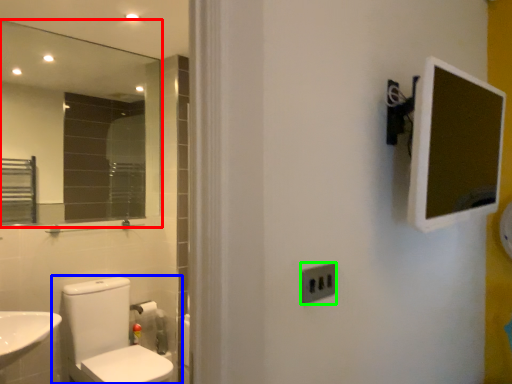
Question: Considering the real-world distances, which object is closest to mirror (highlighted by a red box)? toilet (highlighted by a blue box) or electric outlet (highlighted by a green box).

Choices:
 (A) toilet
 (B) electric outlet

Answer: (A)